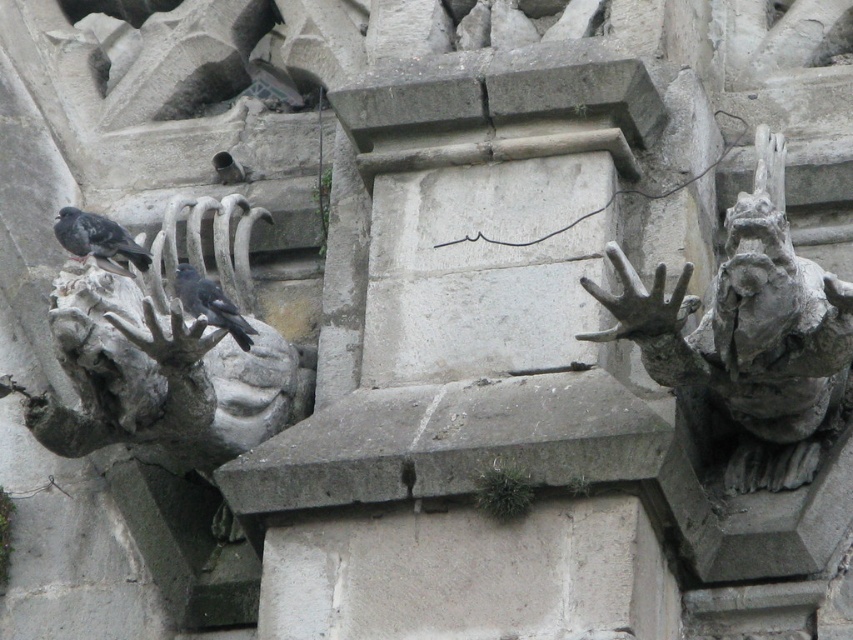
Which is behind, point (764, 486) or point (248, 332)?

Point (248, 332)

Who is more forward, (x=724, y=333) or (x=221, y=324)?

Point (x=724, y=333) is in front.

This screenshot has width=853, height=640. Identify the location of gray stone gargoyle at right. (750, 336).

Can you confirm if gray matte pigeon at left is positioned to the right of gray matte bird at center?

Incorrect, gray matte pigeon at left is not on the right side of gray matte bird at center.

Can you confirm if gray matte pigeon at left is smaller than gray matte bird at center?

No, gray matte pigeon at left is not smaller than gray matte bird at center.

Identify the location of gray matte pigeon at left. (97, 240).

Does gray stone gargoyle at right appear under gray matte pigeon at left?

Yes, gray stone gargoyle at right is below gray matte pigeon at left.

Does gray stone gargoyle at right appear over gray matte pigeon at left?

Incorrect, gray stone gargoyle at right is not positioned above gray matte pigeon at left.

Who is more forward, [844,380] or [111,264]?

Point [844,380] is more forward.

At what (x,y) coordinates should I click in order to perform the action: click on gray stone gargoyle at right. Please return your answer as a coordinate pair (x, y). Image resolution: width=853 pixels, height=640 pixels. Looking at the image, I should click on (750, 336).